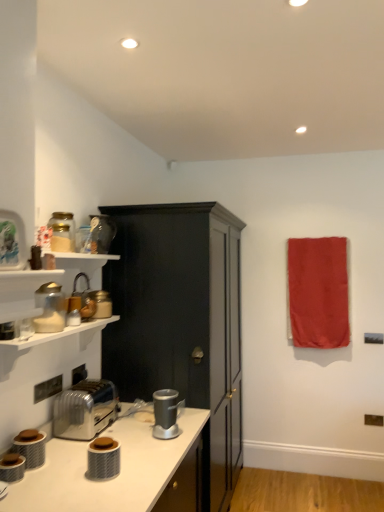
Question: Is matte black canister at lower center, placed as the third appliance when sorted from bottom to top, to the left of matte white blender at left, the fifth appliance positioned from the bottom, from the viewer's perspective?

Choices:
 (A) yes
 (B) no

Answer: (B)

Question: Is matte black canister at lower center, placed as the third appliance when sorted from bottom to top, oriented away from matte white blender at left, the fifth appliance positioned from the bottom?

Choices:
 (A) no
 (B) yes

Answer: (A)

Question: Does matte black canister at lower center, which is the second appliance in front-to-back order, turn towards matte white blender at left, the fourth appliance viewed from the back?

Choices:
 (A) no
 (B) yes

Answer: (A)

Question: From a real-world perspective, does matte black canister at lower center, placed as the sixth appliance when sorted from back to front, stand above matte white blender at left, the fourth appliance viewed from the back?

Choices:
 (A) yes
 (B) no

Answer: (B)

Question: Does matte black canister at lower center, placed as the sixth appliance when sorted from back to front, have a lesser height compared to matte white blender at left, the fifth appliance positioned from the bottom?

Choices:
 (A) no
 (B) yes

Answer: (B)

Question: Is metallic silver toaster at lower left, arranged as the 3th appliance when viewed from the front, wider or thinner than silver metallic toaster at lower left?

Choices:
 (A) thin
 (B) wide

Answer: (A)

Question: In terms of height, does metallic silver toaster at lower left, acting as the 6th appliance starting from the top, look taller or shorter compared to silver metallic toaster at lower left?

Choices:
 (A) tall
 (B) short

Answer: (B)

Question: From the image's perspective, is metallic silver toaster at lower left, acting as the 6th appliance starting from the top, positioned above or below silver metallic toaster at lower left?

Choices:
 (A) above
 (B) below

Answer: (B)

Question: Is metallic silver toaster at lower left, the fifth appliance viewed from the back, in front of or behind silver metallic toaster at lower left in the image?

Choices:
 (A) behind
 (B) front

Answer: (B)

Question: Does point (39, 437) appear closer or farther from the camera than point (97, 225)?

Choices:
 (A) closer
 (B) farther

Answer: (A)

Question: Considering the relative positions of metallic silver toaster at lower left, the fifth appliance viewed from the back, and matte glass jar at upper left, acting as the 7th appliance starting from the bottom, in the image provided, is metallic silver toaster at lower left, the fifth appliance viewed from the back, to the left or to the right of matte glass jar at upper left, acting as the 7th appliance starting from the bottom,?

Choices:
 (A) right
 (B) left

Answer: (B)

Question: Which is correct: metallic silver toaster at lower left, the fifth appliance viewed from the back, is inside matte glass jar at upper left, which is the 2th appliance from back to front, or outside of it?

Choices:
 (A) outside
 (B) inside

Answer: (A)

Question: Considering the positions of metallic silver toaster at lower left, which is the second appliance in bottom-to-top order, and matte glass jar at upper left, acting as the 7th appliance starting from the bottom, in the image, is metallic silver toaster at lower left, which is the second appliance in bottom-to-top order, wider or thinner than matte glass jar at upper left, acting as the 7th appliance starting from the bottom,?

Choices:
 (A) wide
 (B) thin

Answer: (B)

Question: From a real-world perspective, relative to matte glass jar at upper left, which is the 1th appliance from top to bottom, is matte black cabinet at center vertically above or below?

Choices:
 (A) below
 (B) above

Answer: (A)

Question: Is matte black cabinet at center taller or shorter than matte glass jar at upper left, which is the 1th appliance from top to bottom?

Choices:
 (A) short
 (B) tall

Answer: (B)